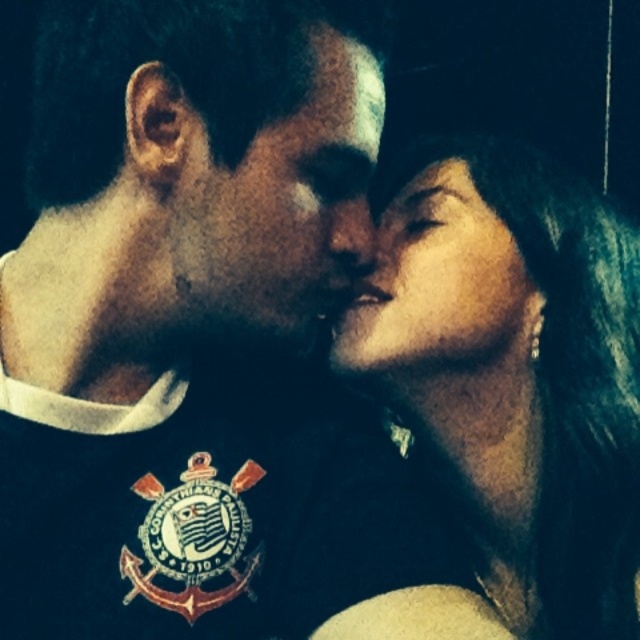
Does matte black hair at upper right lie in front of smooth skin face at center?

Yes, it is in front of smooth skin face at center.

Who is shorter, matte black hair at upper right or smooth skin face at center?

With less height is smooth skin face at center.

This screenshot has height=640, width=640. Find the location of `matte black hair at upper right`. matte black hair at upper right is located at coordinates (506, 388).

Does matte black face at center appear over smooth skin face at center?

Correct, matte black face at center is located above smooth skin face at center.

Can you confirm if matte black face at center is positioned below smooth skin face at center?

Incorrect, matte black face at center is not positioned below smooth skin face at center.

Is point (202, 330) behind point (440, 336)?

No, (202, 330) is closer to viewer.

Locate an element on the screen. The width and height of the screenshot is (640, 640). matte black face at center is located at coordinates pyautogui.click(x=278, y=205).

Can you confirm if matte black hair at upper right is taller than matte black face at center?

Indeed, matte black hair at upper right has a greater height compared to matte black face at center.

Between matte black hair at upper right and matte black face at center, which one is positioned higher?

matte black face at center is higher up.

Image resolution: width=640 pixels, height=640 pixels. In order to click on matte black hair at upper right in this screenshot , I will do `click(506, 388)`.

Locate an element on the screen. matte black hair at upper right is located at coordinates (506, 388).